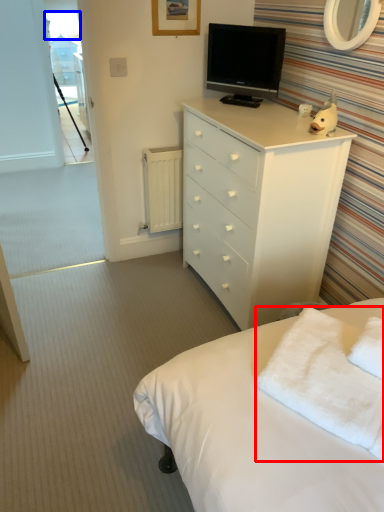
Question: Among these objects, which one is nearest to the camera, towel/napkin (highlighted by a red box) or window screen (highlighted by a blue box)?

Choices:
 (A) towel/napkin
 (B) window screen

Answer: (A)